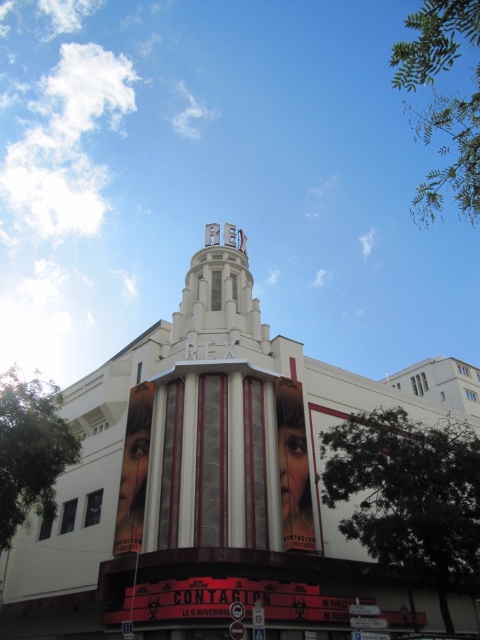
Does point (302, 461) lie behind point (132, 394)?

No, it is in front of (132, 394).

How much distance is there between smooth glossy poster at center and matte metallic poster at center?

smooth glossy poster at center is 39.68 feet away from matte metallic poster at center.

At what (x,y) coordinates should I click in order to perform the action: click on smooth glossy poster at center. Please return your answer as a coordinate pair (x, y). The width and height of the screenshot is (480, 640). Looking at the image, I should click on (294, 467).

Locate an element on the screen. Image resolution: width=480 pixels, height=640 pixels. smooth glossy poster at center is located at coordinates (294, 467).

Looking at this image, who is taller, white/smooth theater at center or smooth glossy poster at center?

Standing taller between the two is white/smooth theater at center.

Can you confirm if white/smooth theater at center is shorter than smooth glossy poster at center?

In fact, white/smooth theater at center may be taller than smooth glossy poster at center.

Between point (431, 406) and point (302, 406), which one is positioned behind?

The point (431, 406) is behind.

Identify the location of white/smooth theater at center. (213, 481).

Does white/smooth theater at center have a lesser width compared to matte metallic poster at center?

In fact, white/smooth theater at center might be wider than matte metallic poster at center.

Is white/smooth theater at center above matte metallic poster at center?

Yes.

Which is behind, point (153, 604) or point (113, 547)?

Positioned behind is point (113, 547).

Locate an element on the screen. The height and width of the screenshot is (640, 480). white/smooth theater at center is located at coordinates (213, 481).